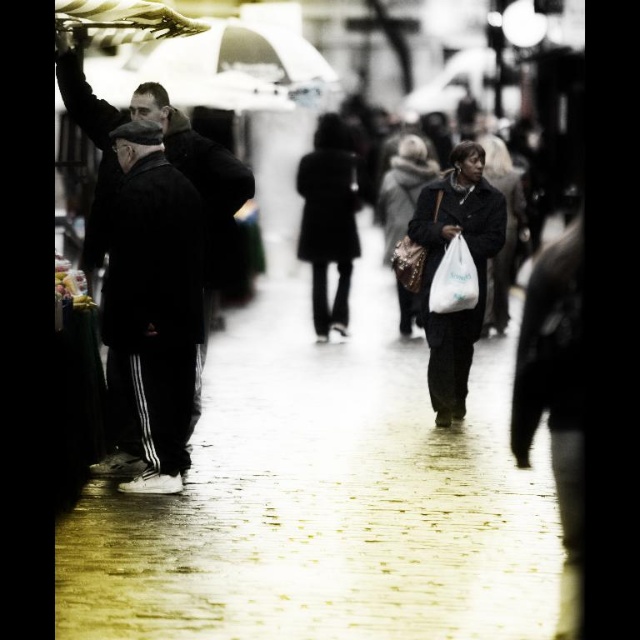
Between black matte pants at left and matte black coat at center, which one appears on the right side from the viewer's perspective?

matte black coat at center is more to the right.

Does black matte pants at left have a greater height compared to matte black coat at center?

Yes, black matte pants at left is taller than matte black coat at center.

The height and width of the screenshot is (640, 640). I want to click on black matte pants at left, so click(156, 300).

Identify the location of black matte pants at left. The image size is (640, 640). (156, 300).

Which is behind, point (499, 408) or point (156, 307)?

The point (499, 408) is behind.

Identify the location of wet brick pavement at center. The height and width of the screenshot is (640, 640). (326, 497).

At what (x,y) coordinates should I click in order to perform the action: click on wet brick pavement at center. Please return your answer as a coordinate pair (x, y). Image resolution: width=640 pixels, height=640 pixels. Looking at the image, I should click on (326, 497).

Is wet brick pavement at center bigger than transparent plastic umbrella at upper left?

No, wet brick pavement at center is not bigger than transparent plastic umbrella at upper left.

Looking at this image, does wet brick pavement at center appear under transparent plastic umbrella at upper left?

Indeed, wet brick pavement at center is positioned under transparent plastic umbrella at upper left.

Is point (369, 252) positioned behind point (83, 20)?

Yes, it is behind point (83, 20).

Locate an element on the screen. wet brick pavement at center is located at coordinates (326, 497).